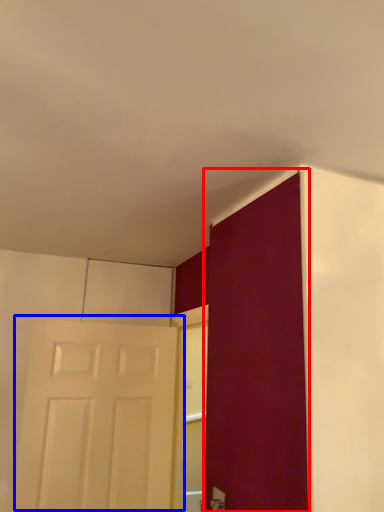
Question: Which object is further to the camera taking this photo, door (highlighted by a red box) or door (highlighted by a blue box)?

Choices:
 (A) door
 (B) door

Answer: (B)